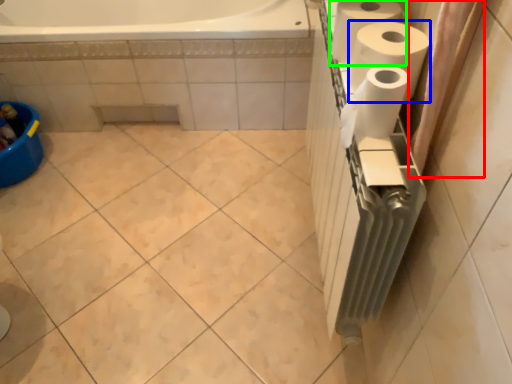
Question: Which object is the farthest from shower curtain (highlighted by a red box)? Choose among these: paper towel (highlighted by a blue box) or paper towel (highlighted by a green box).

Choices:
 (A) paper towel
 (B) paper towel

Answer: (B)